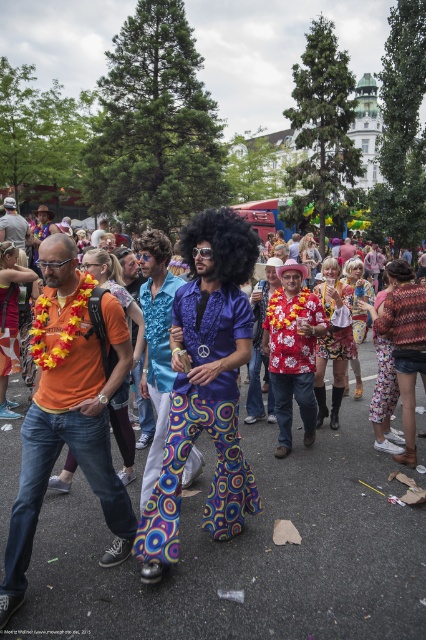
You are a photographer trying to capture the central figure in the image. The central figure is wearing a purple shirt, a large afro wig, and bell bottom pants with a psychedelic pattern of circles. You notice a point at coordinates [293,353] in the image. What object is located at this point?

The point at coordinates [293,353] corresponds to the floral fabric shirt at center, which is the central figure wearing the purple shirt, afro wig, and bell bottom pants.

You are a photographer trying to capture the central figure in the image. You notice the floral fabric shirt at center and the vibrant multicolored wig at center. Which one is located to the right of the other?

The floral fabric shirt at center is positioned on the right side of vibrant multicolored wig at center, so the floral fabric shirt at center is to the right of the vibrant multicolored wig at center.

You are a fashion designer observing the street scene. You need to determine which item is narrower between the vivid multicolored pants at center and the vibrant multicolored wig at center. Which one is it?

The vivid multicolored pants at center is thinner than the vibrant multicolored wig at center, so the vivid multicolored pants at center is narrower.